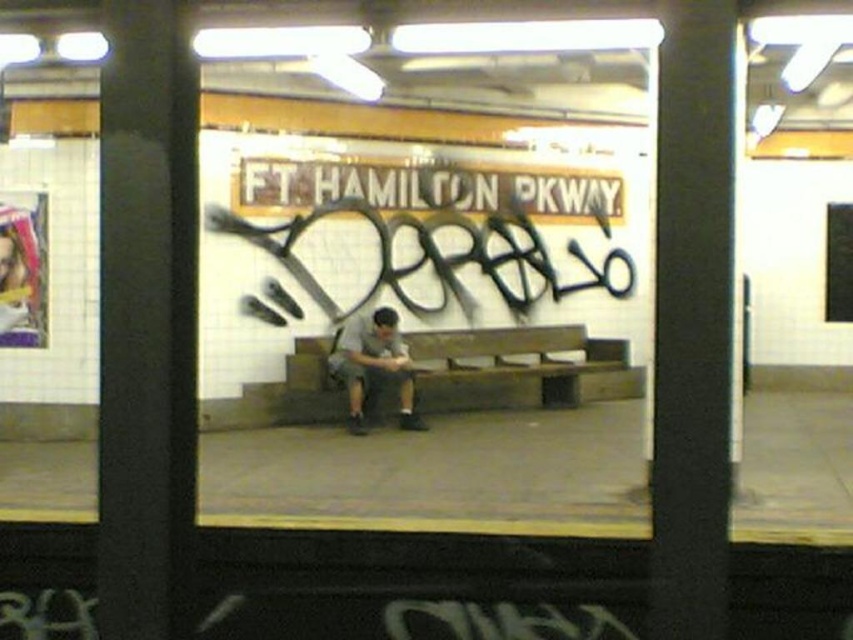
Based on the photo, you are standing at the subway station platform and see two points reflected in the window. The first point is labeled as point (471, 404) and the second as point (369, 349). According to the reflection, which point is closer to you?

Point (369, 349) is closer to you because in the reflection, it is positioned in front of point (471, 404).

You are standing at the entrance of the subway station platform and want to sit down. Where exactly should you go to find the wooden bench at center?

The wooden bench at center is located at point 0.573 on the x axis and 0.600 on the y axis.

You are standing on the subway platform and see the wooden bench at center and the gray fabric shirt at center in the reflection. Which object is closer to you according to the reflection?

The wooden bench at center is positioned over gray fabric shirt at center in the reflection, meaning the wooden bench at center is closer to the reflective surface and therefore closer to you.